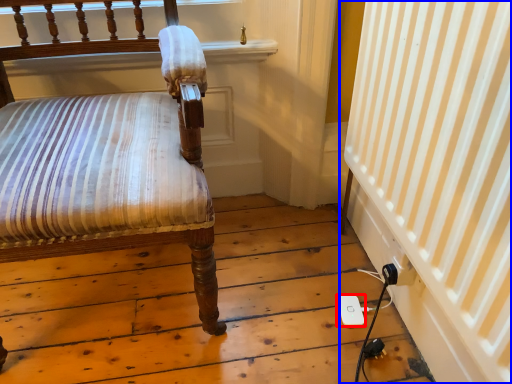
Question: Which point is further to the camera, ipod (highlighted by a red box) or curtain (highlighted by a blue box)?

Choices:
 (A) ipod
 (B) curtain

Answer: (A)